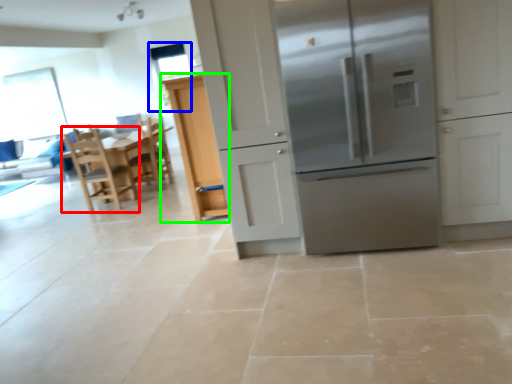
Question: Which object is the closest to the chair (highlighted by a red box)? Choose among these: window screen (highlighted by a blue box) or cabinetry (highlighted by a green box).

Choices:
 (A) window screen
 (B) cabinetry

Answer: (B)